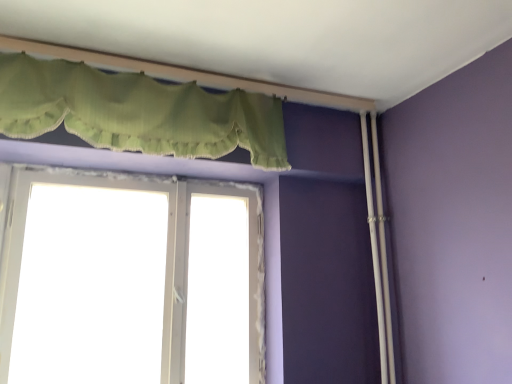
Describe the element at coordinates (138, 112) in the screenshot. Image resolution: width=512 pixels, height=384 pixels. I see `green fabric valance at upper center` at that location.

Where is `green fabric valance at upper center`? green fabric valance at upper center is located at coordinates (138, 112).

This screenshot has width=512, height=384. What do you see at coordinates (130, 280) in the screenshot?
I see `white plastic window at center` at bounding box center [130, 280].

The image size is (512, 384). I want to click on white plastic window at center, so click(130, 280).

The width and height of the screenshot is (512, 384). Find the location of `green fabric valance at upper center`. green fabric valance at upper center is located at coordinates click(138, 112).

Between green fabric valance at upper center and white plastic window at center, which one appears on the right side from the viewer's perspective?

green fabric valance at upper center is more to the right.

Who is more distant, green fabric valance at upper center or white plastic window at center?

white plastic window at center is further away from the camera.

Which point is more forward, [140,109] or [27,278]?

The point [140,109] is closer.

From the image's perspective, is green fabric valance at upper center on white plastic window at center?

Correct, green fabric valance at upper center appears higher than white plastic window at center in the image.

From a real-world perspective, between green fabric valance at upper center and white plastic window at center, who is vertically higher?

green fabric valance at upper center.

In terms of width, does green fabric valance at upper center look wider or thinner when compared to white plastic window at center?

Clearly, green fabric valance at upper center has more width compared to white plastic window at center.

Is green fabric valance at upper center taller than white plastic window at center?

Incorrect, the height of green fabric valance at upper center is not larger of that of white plastic window at center.

Considering the sizes of objects green fabric valance at upper center and white plastic window at center in the image provided, who is smaller, green fabric valance at upper center or white plastic window at center?

white plastic window at center is smaller.

Is green fabric valance at upper center not inside white plastic window at center?

Yes, green fabric valance at upper center is outside of white plastic window at center.

Is green fabric valance at upper center far from white plastic window at center?

Actually, green fabric valance at upper center and white plastic window at center are a little close together.

Is green fabric valance at upper center oriented away from white plastic window at center?

No, white plastic window at center is not at the back of green fabric valance at upper center.

Identify the location of window that is behind the green fabric valance at upper center. Image resolution: width=512 pixels, height=384 pixels. (130, 280).

Considering the positions of objects white plastic window at center and green fabric valance at upper center in the image provided, who is more to the right, white plastic window at center or green fabric valance at upper center?

green fabric valance at upper center.

Is white plastic window at center behind green fabric valance at upper center?

Yes, it is behind green fabric valance at upper center.

Is point (115, 252) farther from camera compared to point (177, 105)?

Yes, point (115, 252) is farther from viewer.

From the image's perspective, which object appears higher, white plastic window at center or green fabric valance at upper center?

green fabric valance at upper center is shown above in the image.

Looking at this image, from a real-world perspective, is white plastic window at center positioned above or below green fabric valance at upper center?

white plastic window at center is below green fabric valance at upper center.

Does white plastic window at center have a greater width compared to green fabric valance at upper center?

No.

Is white plastic window at center taller than green fabric valance at upper center?

Correct, white plastic window at center is much taller as green fabric valance at upper center.

Between white plastic window at center and green fabric valance at upper center, which one has smaller size?

With smaller size is white plastic window at center.

Is white plastic window at center situated inside green fabric valance at upper center or outside?

The correct answer is: outside.

Does white plastic window at center touch green fabric valance at upper center?

No, white plastic window at center is not next to green fabric valance at upper center.

Is white plastic window at center looking in the opposite direction of green fabric valance at upper center?

That's not correct — white plastic window at center is not looking away from green fabric valance at upper center.

How far apart are white plastic window at center and green fabric valance at upper center?

white plastic window at center and green fabric valance at upper center are 21.60 inches apart.

Where is `window behind the green fabric valance at upper center`? window behind the green fabric valance at upper center is located at coordinates (130, 280).

Where is `window behind the green fabric valance at upper center`? The height and width of the screenshot is (384, 512). window behind the green fabric valance at upper center is located at coordinates (130, 280).

The height and width of the screenshot is (384, 512). I want to click on curtain lying above the white plastic window at center (from the image's perspective), so click(138, 112).